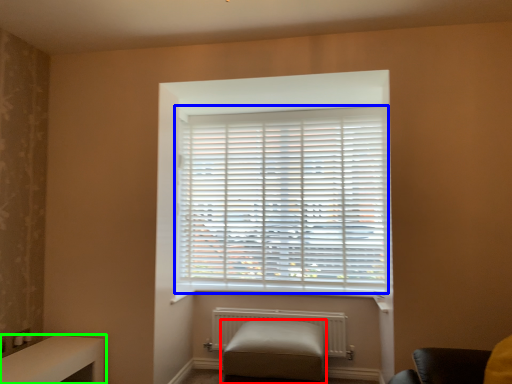
Question: Estimate the real-world distances between objects in this image. Which object is farther from furniture (highlighted by a red box), window blind (highlighted by a blue box) or table (highlighted by a green box)?

Choices:
 (A) window blind
 (B) table

Answer: (B)